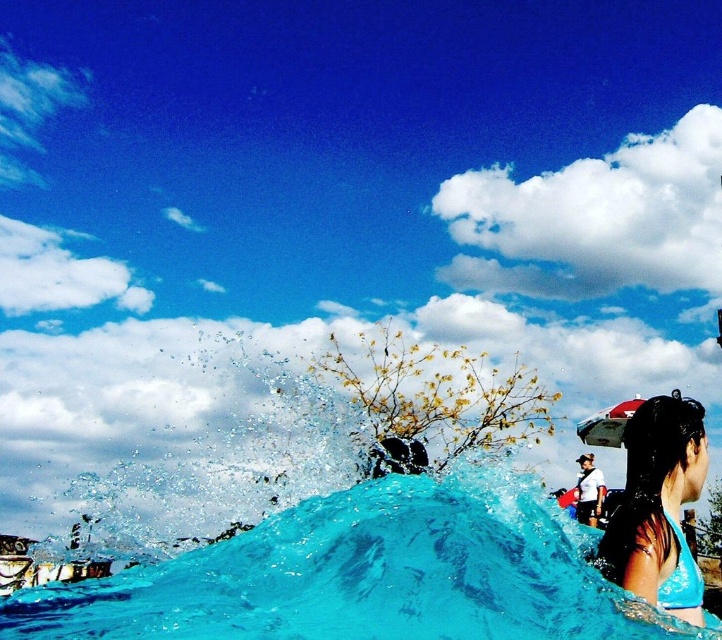
You are standing at the edge of the scene and want to jump into the translucent blue water at center. Based on its position, is the water directly in front of you or to one side?

The translucent blue water at center is located at point 0.902 on the x and 0.508 on the y, which means it is positioned slightly to the right and center of the scene. Since you are at the edge, it would be to your side rather than directly in front.

Based on the scene description, where is the clear water splash at center located in the image?

The clear water splash at center is located at point [186,444].

You are standing at the edge of the turquoise water in the foreground of the scene. There is a point marked at coordinates (365, 577). What object is located at that point?

The translucent blue water at center is located at point (365, 577).